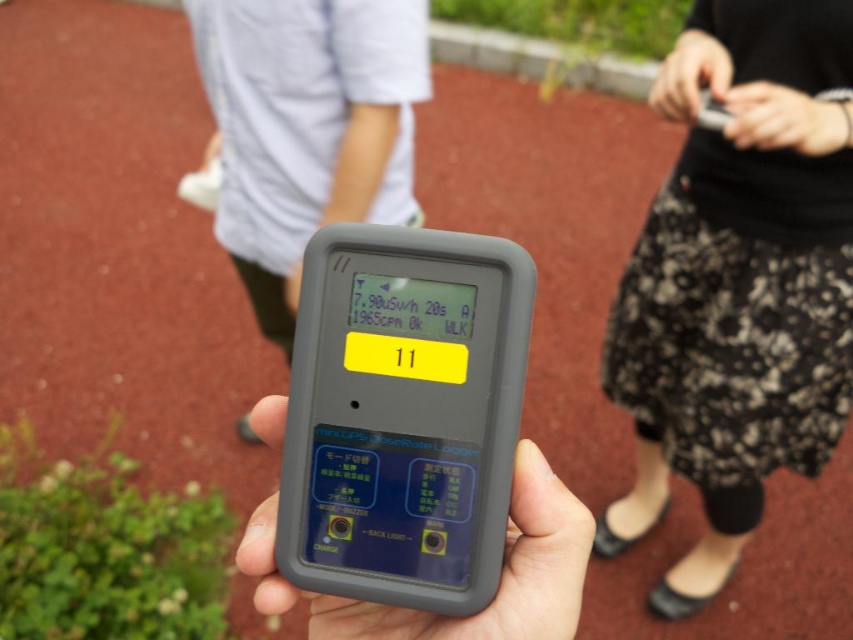
You are a safety inspector examining the scene. You notice the black lace skirt at lower right and the black rubberized device at center. Which object is positioned higher in the image?

The black lace skirt at lower right is much taller than the black rubberized device at center, so it is positioned higher in the image.

Based on the photo, you are a fashion designer observing the scene. You need to decide which item is wider between the black lace skirt at lower right and the black rubberized device at center. Which one is wider?

The black lace skirt at lower right is wider than the black rubberized device at center.

You are a safety inspector needing to check the radiation device. You are standing 1 meter away from the black rubberized device at center. Can you safely reach the black lace skirt at lower right without moving closer than 1 meter to the device?

The distance between the black lace skirt at lower right and the black rubberized device at center is 1.27 meters. Since you are already 1 meter away from the device, you can safely reach the skirt without getting closer than 1 meter to the device.